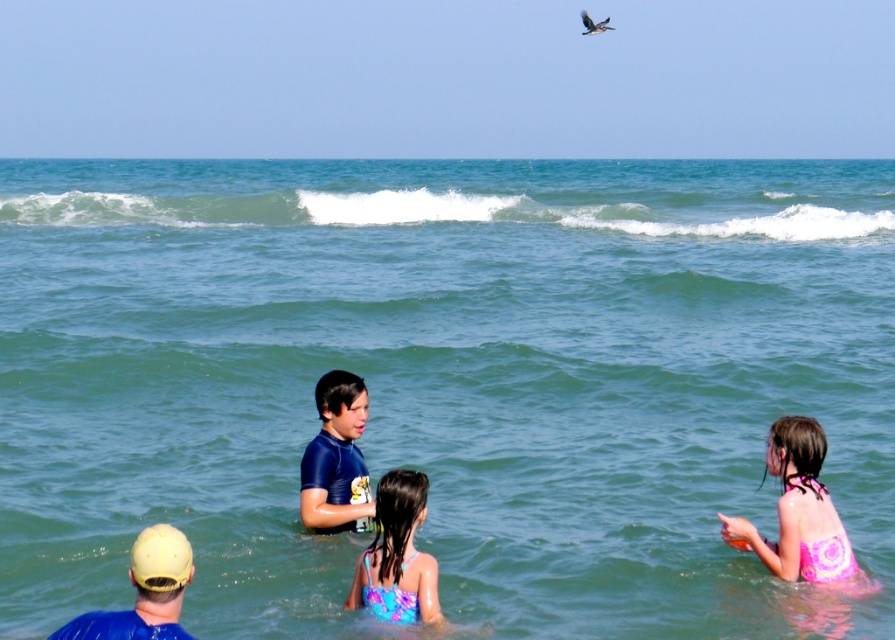
Question: Is the position of multicolored swimsuit at center less distant than that of blue fabric cap at lower left?

Choices:
 (A) yes
 (B) no

Answer: (B)

Question: Among these objects, which one is nearest to the camera?

Choices:
 (A) blue fabric cap at lower left
 (B) pink floral swimsuit at lower right
 (C) multicolored swimsuit at center
 (D) blue wetsuit at center

Answer: (A)

Question: Considering the real-world distances, which object is closest to the multicolored swimsuit at center?

Choices:
 (A) blue fabric cap at lower left
 (B) blue wetsuit at center

Answer: (B)

Question: Among these objects, which one is farthest from the camera?

Choices:
 (A) pink floral swimsuit at lower right
 (B) multicolored swimsuit at center
 (C) blue fabric cap at lower left

Answer: (A)

Question: Is pink floral swimsuit at lower right thinner than blue wetsuit at center?

Choices:
 (A) yes
 (B) no

Answer: (B)

Question: Where is pink floral swimsuit at lower right located in relation to blue wetsuit at center in the image?

Choices:
 (A) right
 (B) left

Answer: (A)